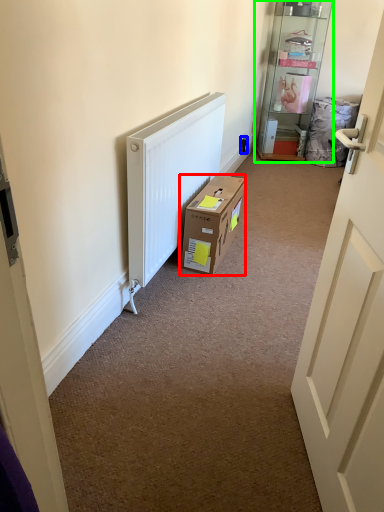
Question: Which object is positioned closest to box (highlighted by a red box)? Select from electric outlet (highlighted by a blue box) and shelf (highlighted by a green box).

Choices:
 (A) electric outlet
 (B) shelf

Answer: (A)